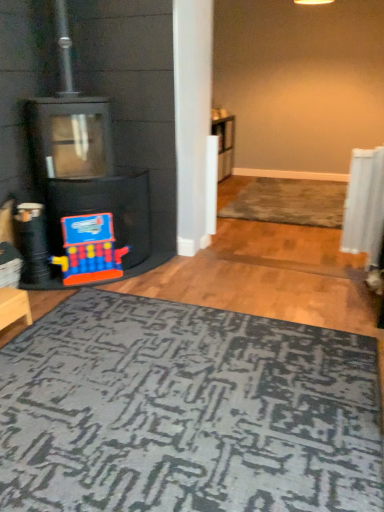
Where is `empty space that is in between matte plastic toy at lower left and dark gray textured rug at lower center`? The width and height of the screenshot is (384, 512). empty space that is in between matte plastic toy at lower left and dark gray textured rug at lower center is located at coordinates (171, 298).